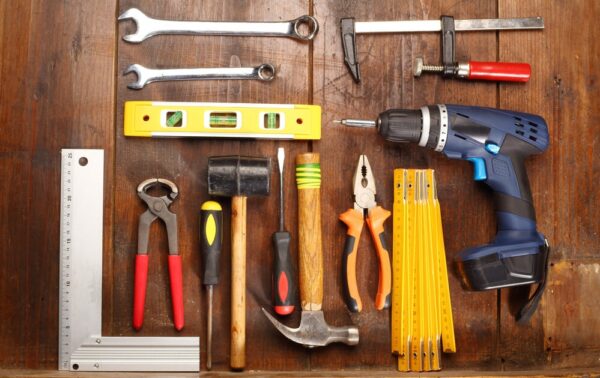
Image resolution: width=600 pixels, height=378 pixels. Identify the location of clamp. pyautogui.click(x=348, y=43), pyautogui.click(x=418, y=63), pyautogui.click(x=357, y=66), pyautogui.click(x=484, y=70).